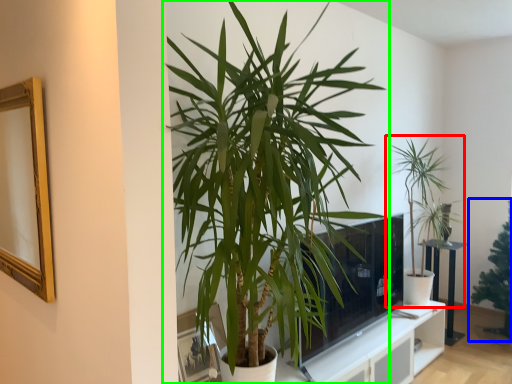
Question: Which object is positioned farthest from houseplant (highlighted by a red box)? Select from houseplant (highlighted by a blue box) and houseplant (highlighted by a green box).

Choices:
 (A) houseplant
 (B) houseplant

Answer: (B)